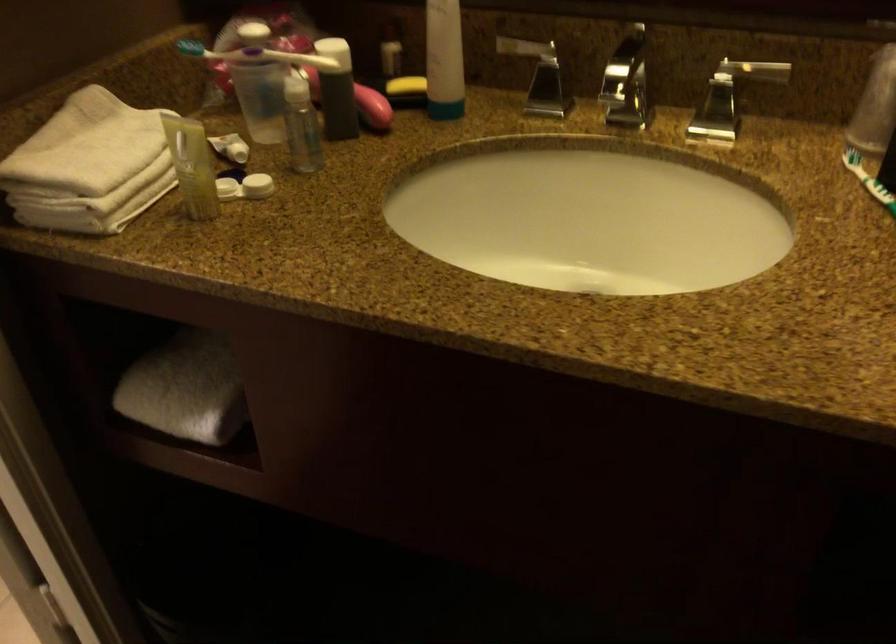
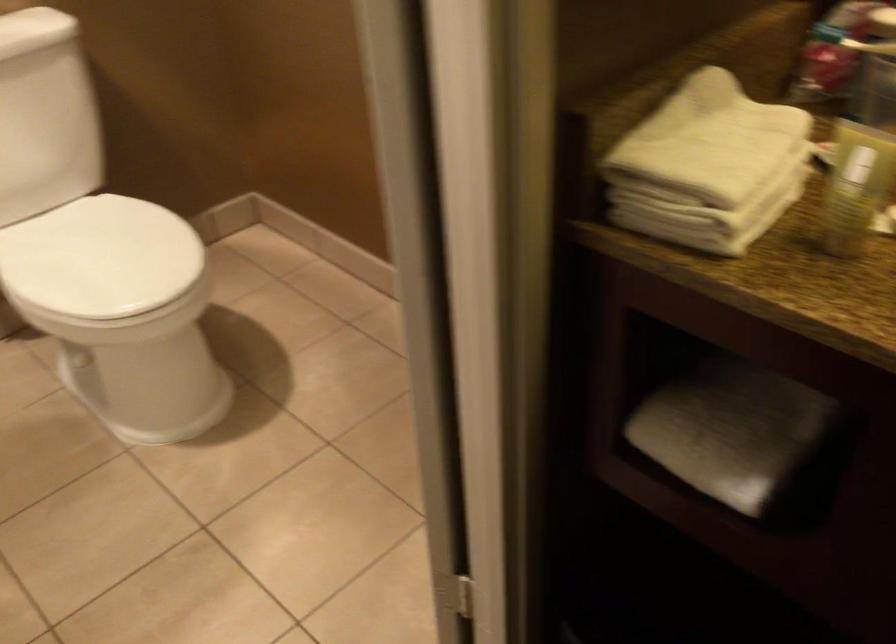
Question: I am providing you with two images of the same scene from different viewpoints. Which of the following objects are not visible in image2?

Choices:
 (A) yellow lotion bottle
 (B) folded white towel
 (C) white toilet lid
 (D) none of these

Answer: (D)